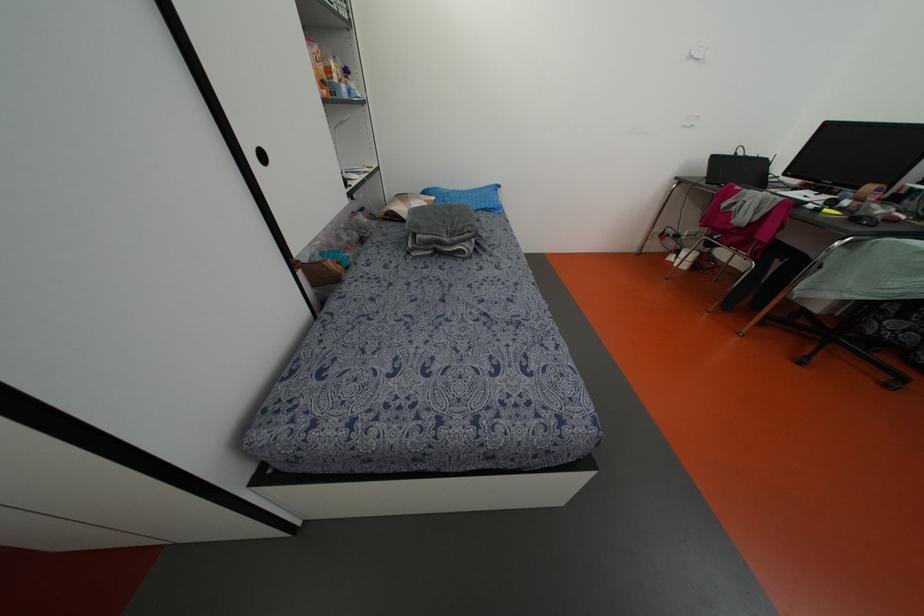
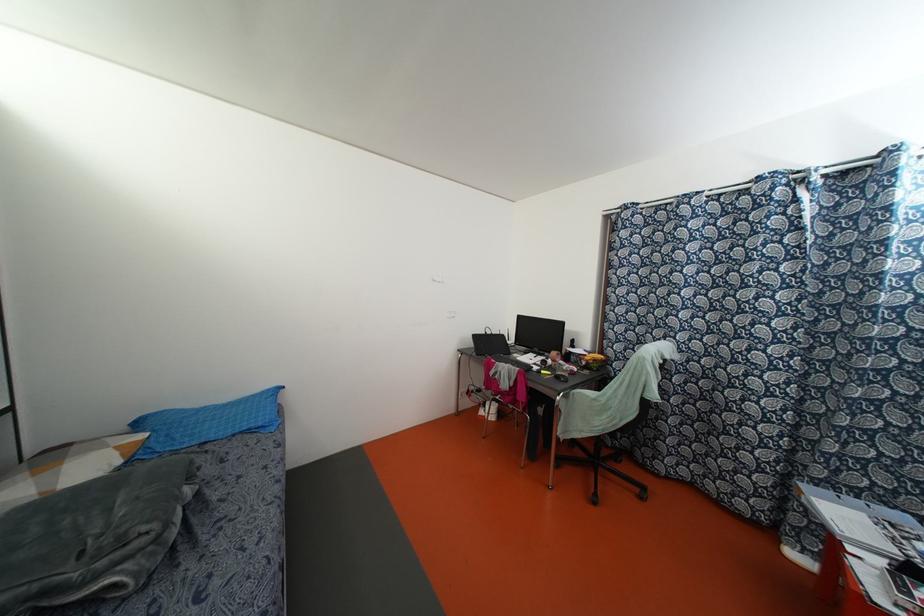
The images are taken continuously from a first-person perspective. In which direction is your viewpoint rotating?

The camera's rotation is toward right-up.